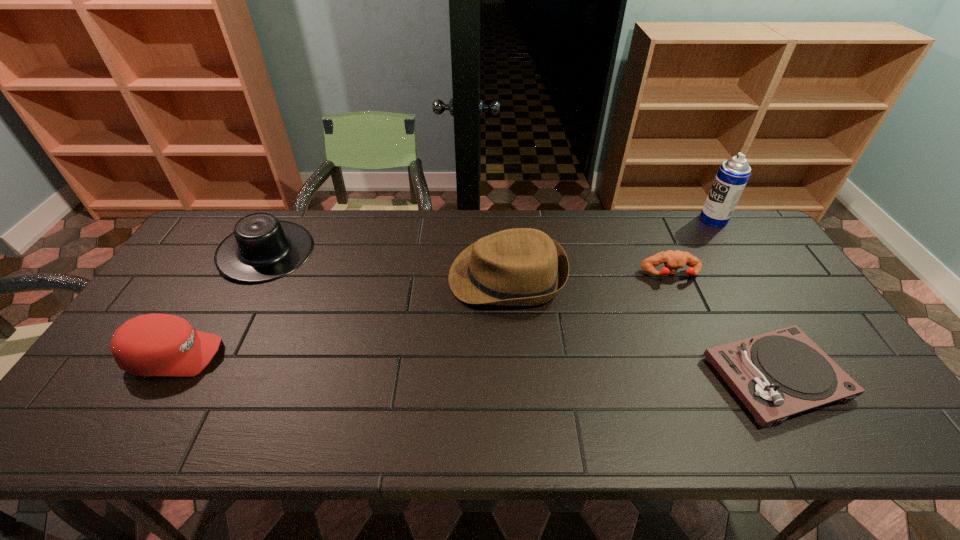
Where is `aerosol can`? aerosol can is located at coordinates (733, 174).

Find the location of a particular element. fedora is located at coordinates (515, 267).

Locate an element on the screen. dress hat is located at coordinates (262, 248).

Where is `cap`? cap is located at coordinates (154, 344).

I want to click on puncher, so click(673, 260).

Identify the location of phonograph_record. The image size is (960, 540). (777, 374).

Where is `free space located on the label side of the tallest object`? Image resolution: width=960 pixels, height=540 pixels. free space located on the label side of the tallest object is located at coordinates (685, 219).

Find the location of a particular element. This screenshot has width=960, height=540. free space located 0.120m on the label side of the tallest object is located at coordinates (665, 219).

Where is `vacant space positioned on the label side of the tallest object`? The width and height of the screenshot is (960, 540). vacant space positioned on the label side of the tallest object is located at coordinates (685, 219).

Locate an element on the screen. free region located 0.400m on the front-facing side of the fedora is located at coordinates (315, 277).